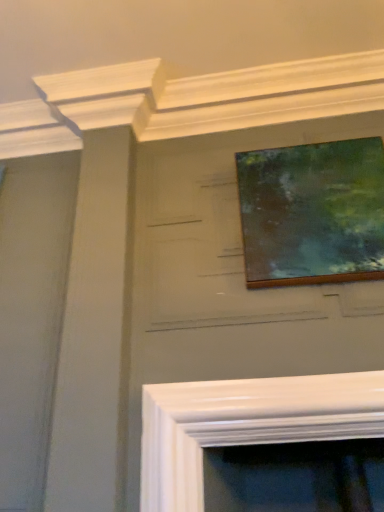
Where is `wooden painting frame at upper center`? Image resolution: width=384 pixels, height=512 pixels. wooden painting frame at upper center is located at coordinates (312, 213).

What do you see at coordinates (312, 213) in the screenshot? I see `wooden painting frame at upper center` at bounding box center [312, 213].

Where is `wooden painting frame at upper center`? The height and width of the screenshot is (512, 384). wooden painting frame at upper center is located at coordinates (312, 213).